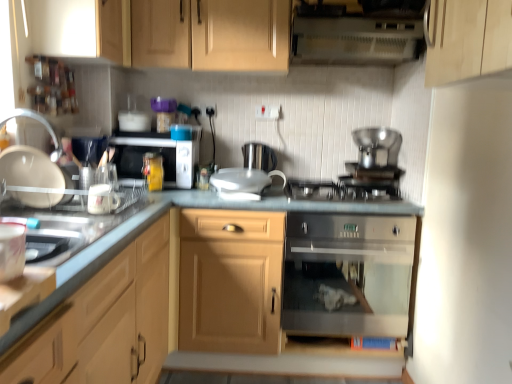
Question: Is point (272, 71) closer or farther from the camera than point (358, 18)?

Choices:
 (A) closer
 (B) farther

Answer: (B)

Question: In terms of size, does wooden cabinet at upper center, marked as the fourth cabinetry in a bottom-to-top arrangement, appear bigger or smaller than white plastic vent at upper center?

Choices:
 (A) big
 (B) small

Answer: (A)

Question: Which object is the closest to the white glossy plate at left?

Choices:
 (A) white glossy mug at left, the third appliance when ordered from right to left
 (B) wooden cabinet at upper center, marked as the fourth cabinetry in a bottom-to-top arrangement
 (C) light wood cabinet at upper left, which is the second cabinetry in top-to-bottom order
 (D) matte wood cabinet at center, which is the 4th cabinetry from top to bottom
 (E) stainless steel gas stove at center

Answer: (A)

Question: Based on their relative distances, which object is nearer to the matte white mug at left, the 1th appliance positioned from the front?

Choices:
 (A) matte wood cabinet at center, which is the 4th cabinetry from top to bottom
 (B) white plastic vent at upper center
 (C) light wood cabinet at left, the second cabinetry from the bottom
 (D) wooden cabinet at upper center, marked as the fourth cabinetry in a bottom-to-top arrangement
 (E) stainless steel gas stove at center

Answer: (C)